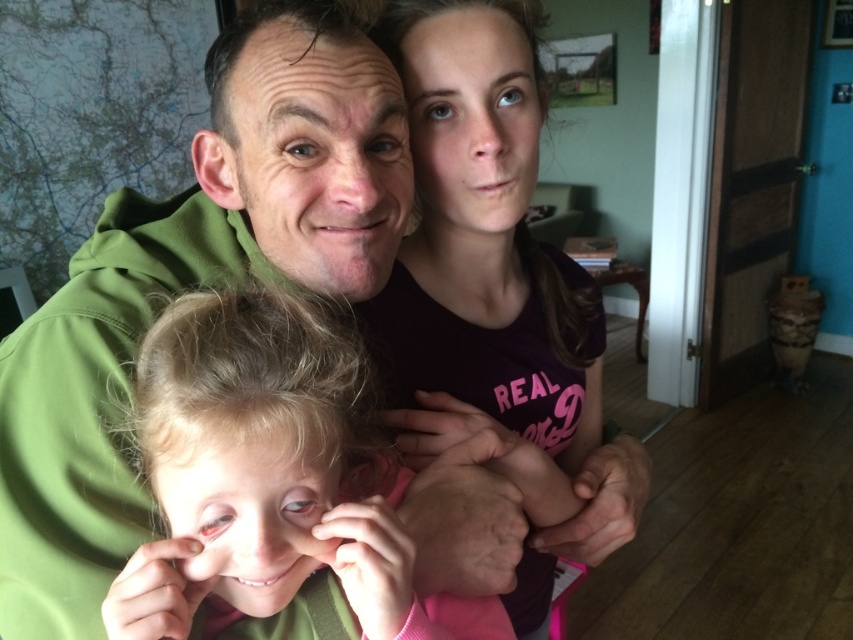
Is point (537, 266) positioned after point (131, 573)?

That is True.

How far apart are matte purple shirt at upper center and blonde hair at center?

8.58 inches

Between point (535, 24) and point (250, 400), which one is positioned in front?

Point (250, 400) is in front.

Find the location of a particular element. The image size is (853, 640). matte purple shirt at upper center is located at coordinates [488, 276].

The width and height of the screenshot is (853, 640). What do you see at coordinates (190, 285) in the screenshot?
I see `green matte hoodie at center` at bounding box center [190, 285].

Which is more to the left, green matte hoodie at center or matte purple shirt at upper center?

green matte hoodie at center is more to the left.

You are a GUI agent. You are given a task and a screenshot of the screen. Output one action in this format:
    pyautogui.click(x=<x>, y=<y>)
    Task: Click on the green matte hoodie at center
    The width and height of the screenshot is (853, 640).
    Given the screenshot: What is the action you would take?
    pyautogui.click(x=190, y=285)

Does green matte hoodie at center have a greater width compared to blonde hair at center?

Yes, green matte hoodie at center is wider than blonde hair at center.

Does green matte hoodie at center have a larger size compared to blonde hair at center?

Yes.

Is point (96, 627) more distant than point (216, 580)?

Yes, it is behind point (216, 580).

Where is `green matte hoodie at center`? The image size is (853, 640). green matte hoodie at center is located at coordinates (190, 285).